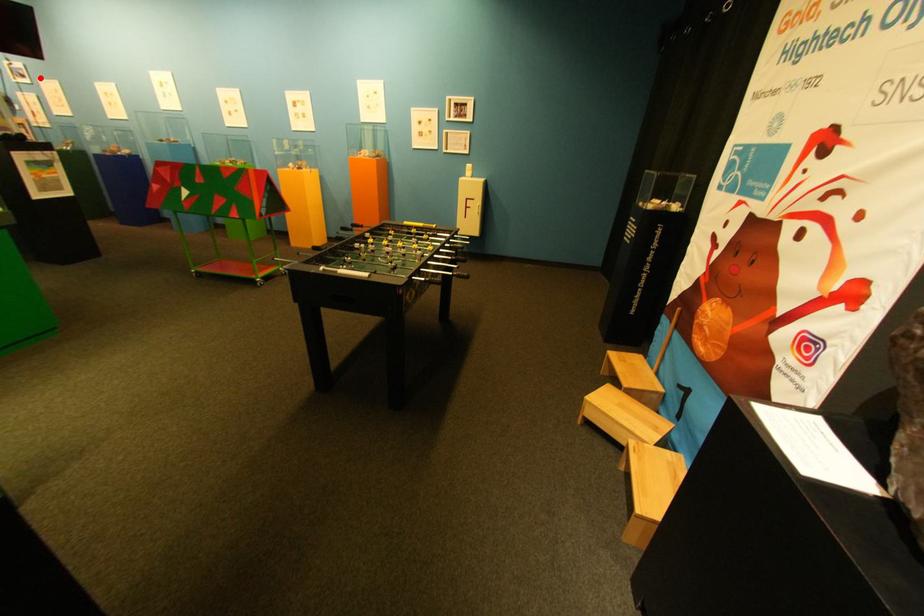
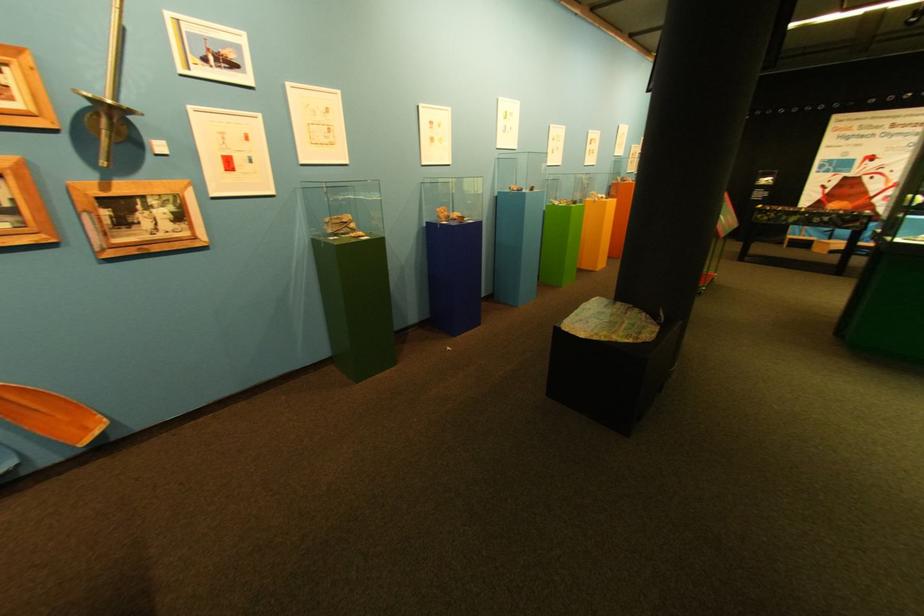
Question: I am providing you with two images of the same scene from different viewpoints. A red point is shown in image1. For the corresponding object point in image2, is it positioned nearer or farther from the camera?

Choices:
 (A) Nearer
 (B) Farther

Answer: (A)